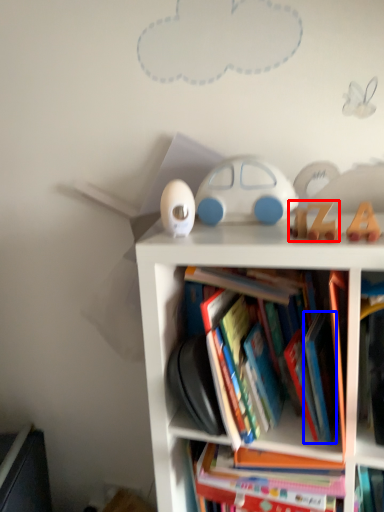
Question: Which object is further to the camera taking this photo, toy (highlighted by a red box) or paperback book (highlighted by a blue box)?

Choices:
 (A) toy
 (B) paperback book

Answer: (A)